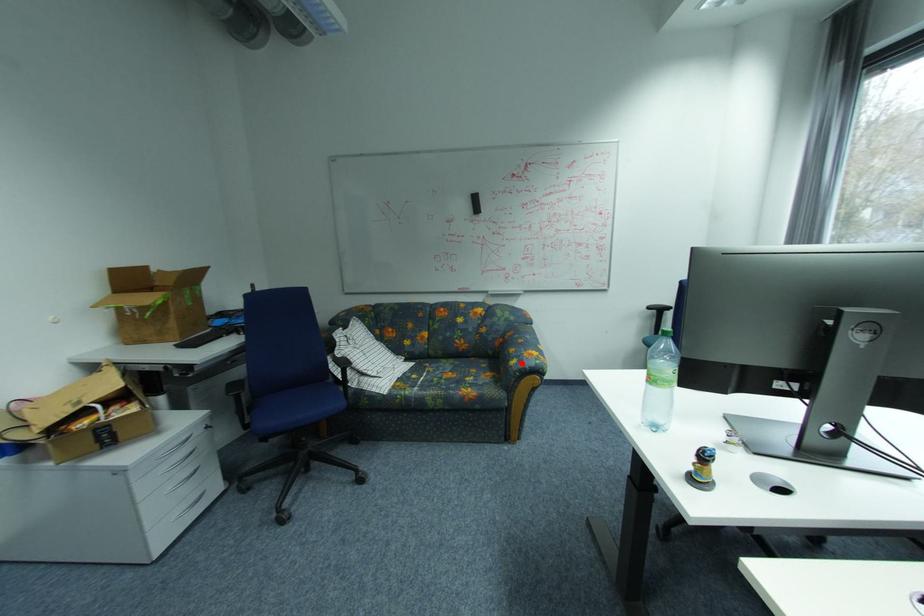
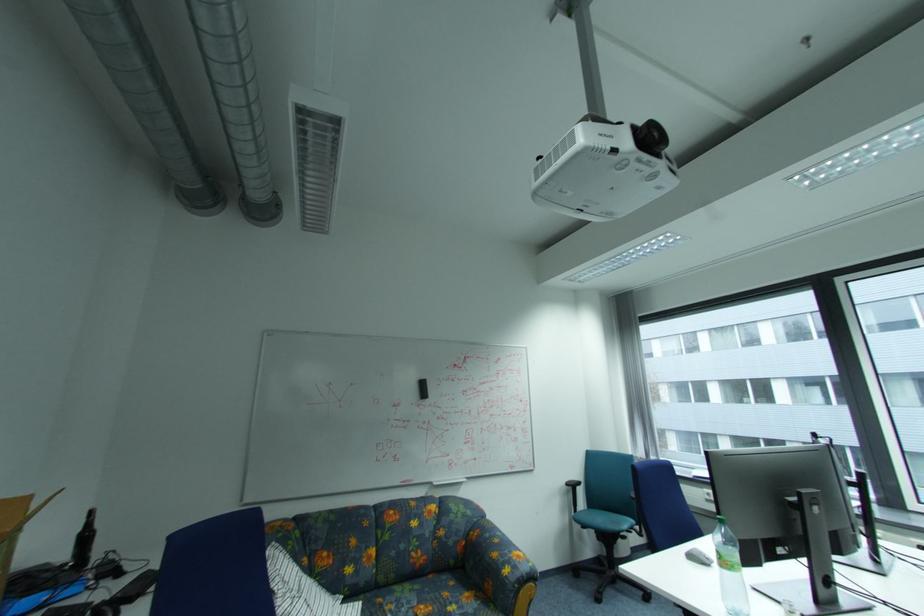
Where in the second image is the point corresponding to the highlighted location from the first image?

(515, 572)